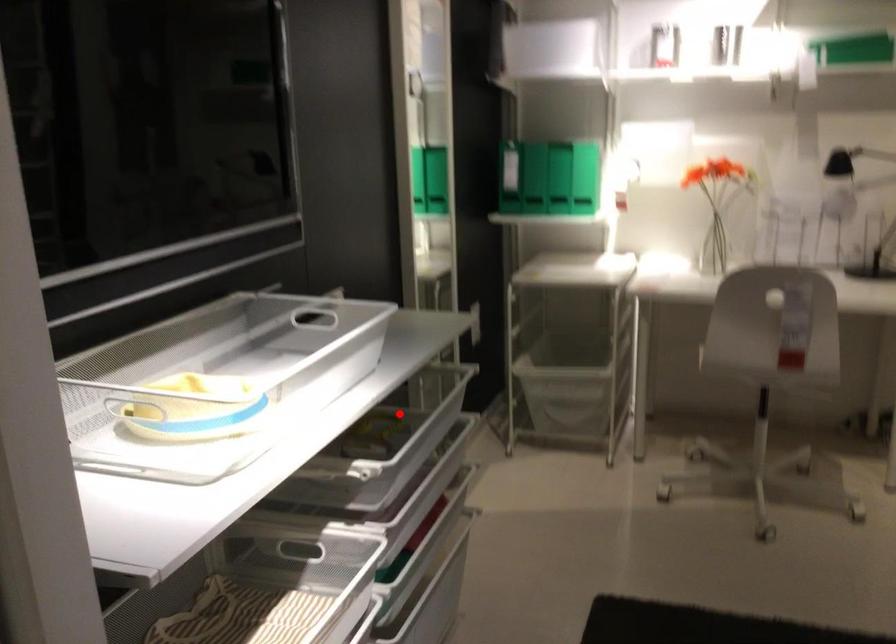
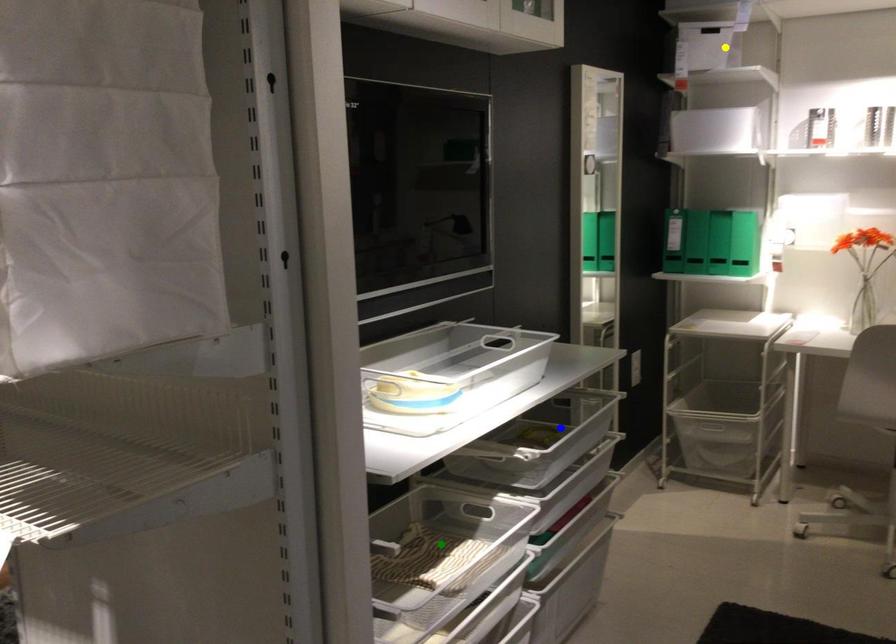
Question: I am providing you with two images of the same scene from different viewpoints. A red point is marked on the first image. You are given multiple points on the second image. Which point in image 2 is actually the same real-world point as the red point in image 1?

Choices:
 (A) blue point
 (B) yellow point
 (C) green point

Answer: (A)